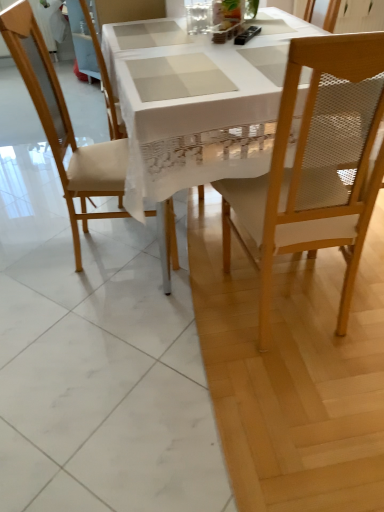
Identify the location of unoccupied region to the right of matte wood chair at left, placed as the 3th chair when sorted from right to left. (200, 238).